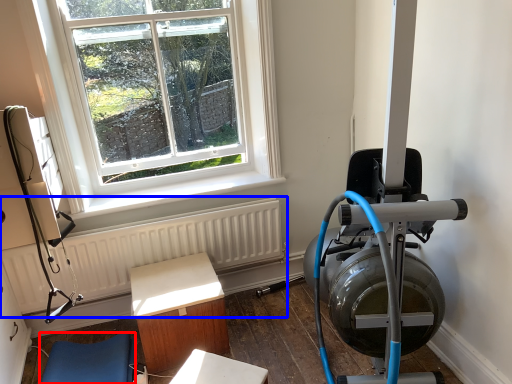
Question: Which object is closer to the camera taking this photo, furniture (highlighted by a red box) or radiator (highlighted by a blue box)?

Choices:
 (A) furniture
 (B) radiator

Answer: (A)